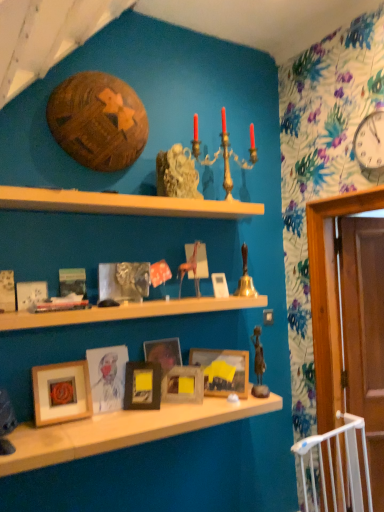
Question: From a real-world perspective, is white glossy clock at upper right positioned above or below matte black picture frame at center, the fourth picture frame positioned from the right?

Choices:
 (A) below
 (B) above

Answer: (B)

Question: From the image's perspective, relative to matte black picture frame at center, the fourth picture frame positioned from the right, is white glossy clock at upper right above or below?

Choices:
 (A) above
 (B) below

Answer: (A)

Question: Which of these objects is positioned farthest from the wooden shelf at upper center, the third shelf ordered from the bottom?

Choices:
 (A) matte black picture frame at center, the fourth picture frame positioned from the right
 (B) wooden picture frame at center, arranged as the first picture frame when viewed from the right
 (C) white glossy clock at upper right
 (D) matte white picture frame at center, acting as the seventh picture frame starting from the right
 (E) wooden picture frame at lower left, placed as the 2th picture frame when sorted from left to right

Answer: (C)

Question: Estimate the real-world distances between objects in this image. Which object is farther from the wooden picture frame at center, marked as the 3th picture frame in a right-to-left arrangement?

Choices:
 (A) bronze statue at center-right
 (B) wooden shelf at lower center, the third shelf viewed from the top
 (C) wooden shelf at center, the 2th shelf when ordered from top to bottom
 (D) wooden picture frame at center, which ranks as the second picture frame in right-to-left order
 (E) wooden picture frame at lower left, placed as the 2th picture frame when sorted from left to right

Answer: (E)